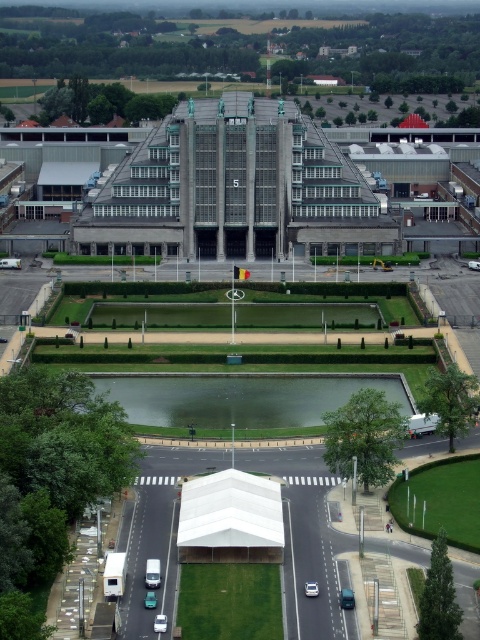
Is point (157, 573) closer to camera compared to point (158, 620)?

No, (157, 573) is further to viewer.

Does point (153, 577) come in front of point (164, 628)?

No, (153, 577) is further to viewer.

Locate an element on the screen. This screenshot has height=640, width=480. metallic silver van at center is located at coordinates (153, 573).

Who is shorter, metallic silver van at center or metallic silver car at lower center?

metallic silver car at lower center

Who is taller, metallic silver van at center or metallic silver car at lower center?

With more height is metallic silver van at center.

Which is behind, point (159, 566) or point (148, 593)?

Positioned behind is point (159, 566).

Find the location of a particular element. metallic silver van at center is located at coordinates (153, 573).

Is teal matte car at center wider than white glossy car at center?

Correct, the width of teal matte car at center exceeds that of white glossy car at center.

In the scene shown: Between teal matte car at center and white glossy car at center, which one appears on the right side from the viewer's perspective?

From the viewer's perspective, teal matte car at center appears more on the right side.

Is point (345, 589) farther from viewer compared to point (307, 592)?

That is False.

The height and width of the screenshot is (640, 480). In order to click on teal matte car at center in this screenshot , I will do `click(347, 598)`.